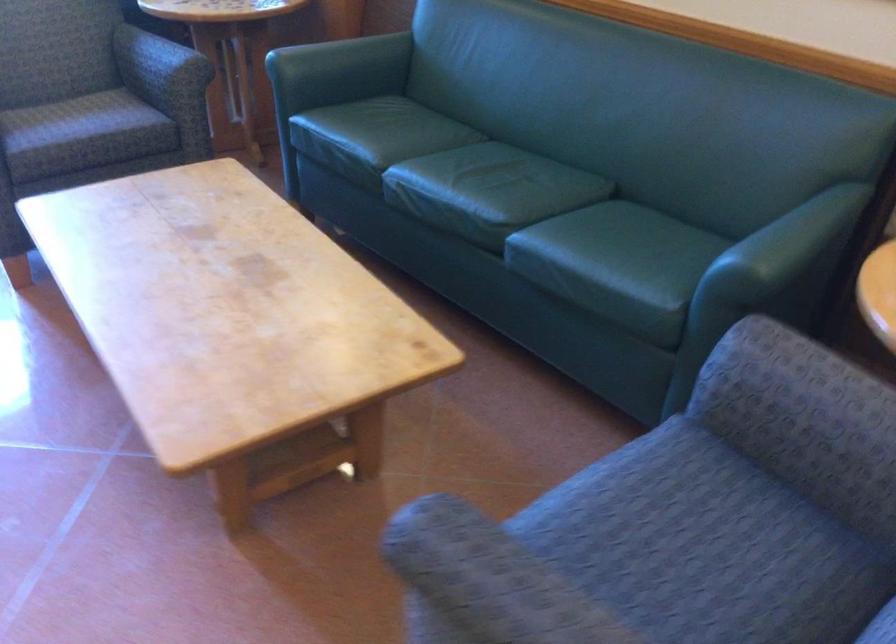
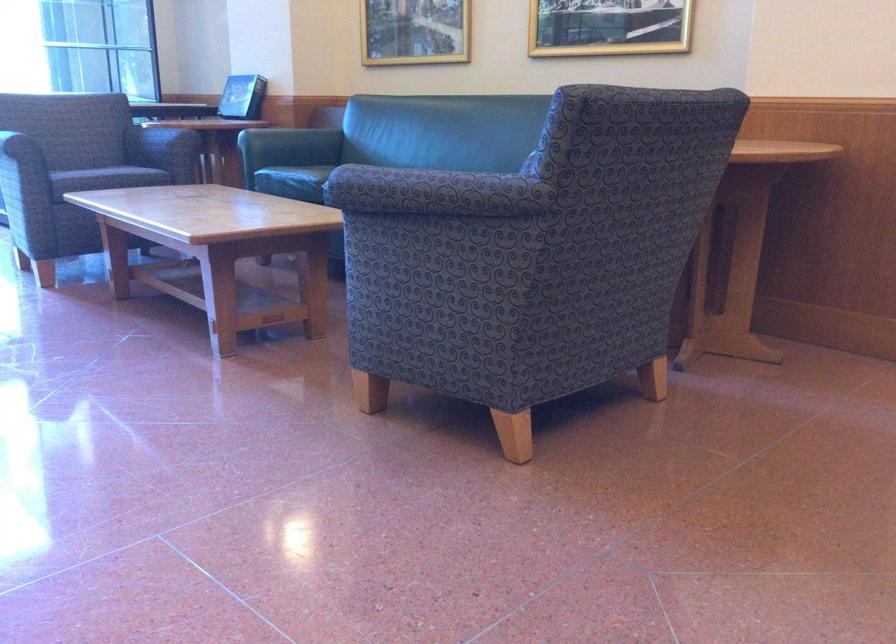
Question: I am providing you with two images of the same scene from different viewpoints. Which of the following objects are not visible in image2?

Choices:
 (A) sofa sitting surface
 (B) patterned chair sitting surface
 (C) sofa armrest
 (D) cabinet door

Answer: (B)